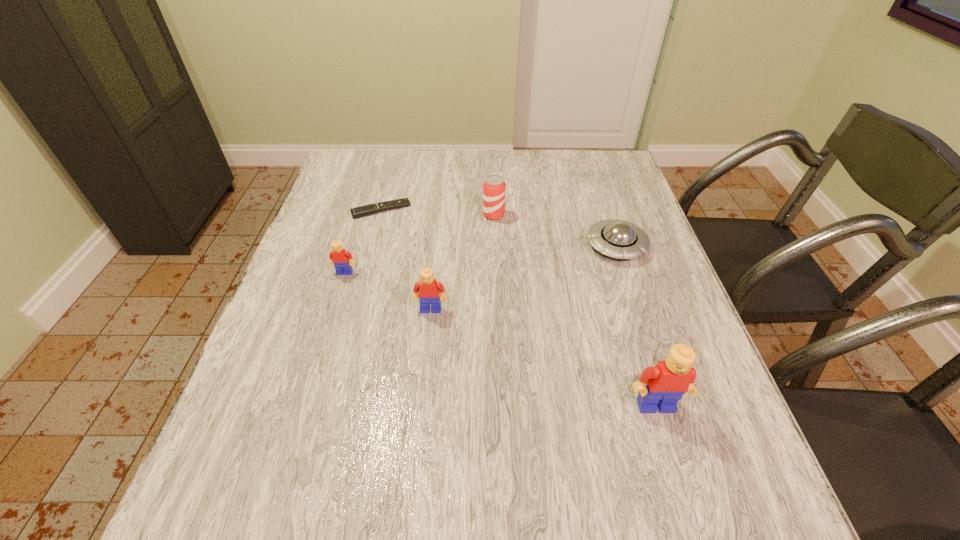
If equal spacing is desired by inserting an extra Lego among them, please point out a free spot for this new Lego. Please provide its 2D coordinates. Your answer should be formatted as a tuple, i.e. [(x, y)], where the tuple contains the x and y coordinates of a point satisfying the conditions above.

[(533, 353)]